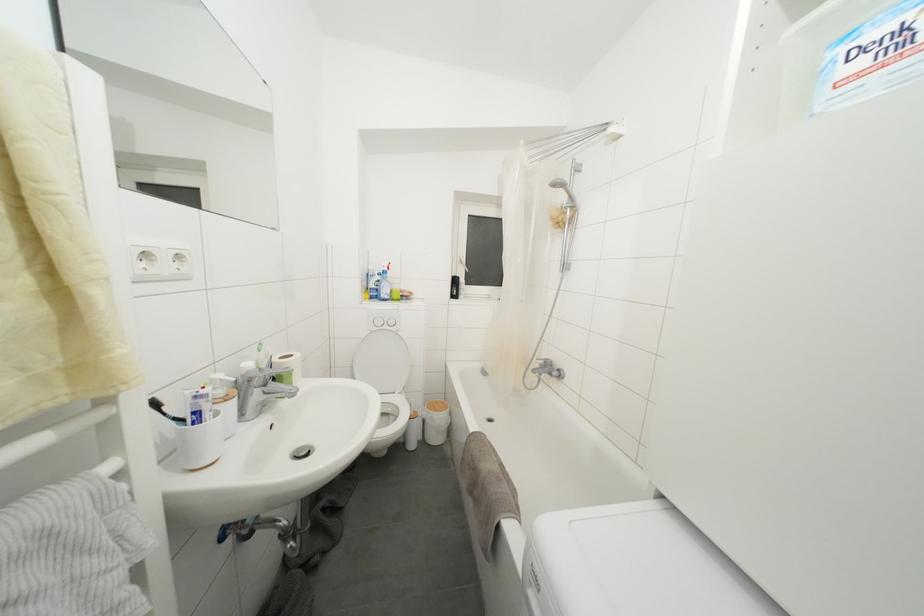
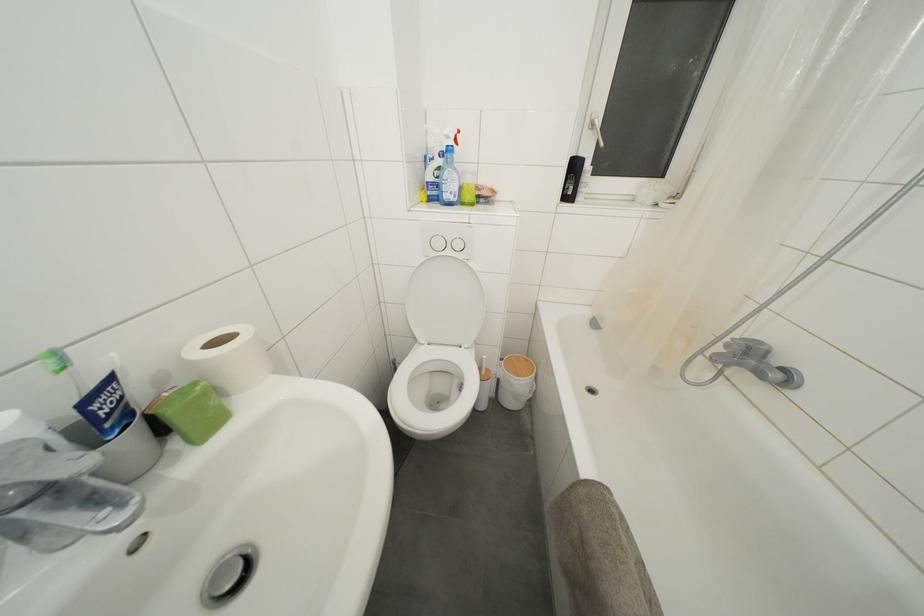
In the second image, find the point that corresponds to (309,459) in the first image.

(233, 592)